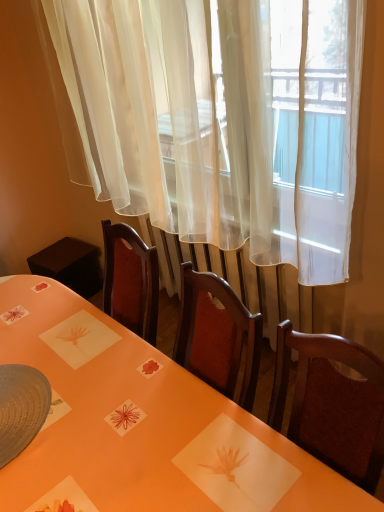
Question: Is orange glossy table at center far away from white sheer curtain at upper center?

Choices:
 (A) no
 (B) yes

Answer: (A)

Question: Can you confirm if orange glossy table at center is positioned to the left of white sheer curtain at upper center?

Choices:
 (A) no
 (B) yes

Answer: (B)

Question: Does orange glossy table at center have a greater width compared to white sheer curtain at upper center?

Choices:
 (A) no
 (B) yes

Answer: (B)

Question: Is orange glossy table at center positioned in front of white sheer curtain at upper center?

Choices:
 (A) yes
 (B) no

Answer: (A)

Question: Is orange glossy table at center surrounding white sheer curtain at upper center?

Choices:
 (A) yes
 (B) no

Answer: (B)

Question: From the image's perspective, would you say orange glossy table at center is positioned over white sheer curtain at upper center?

Choices:
 (A) yes
 (B) no

Answer: (B)

Question: From the image's perspective, is white sheer curtain at upper center under orange glossy table at center?

Choices:
 (A) no
 (B) yes

Answer: (A)

Question: Considering the relative sizes of white sheer curtain at upper center and orange glossy table at center in the image provided, is white sheer curtain at upper center bigger than orange glossy table at center?

Choices:
 (A) yes
 (B) no

Answer: (B)

Question: From a real-world perspective, is white sheer curtain at upper center under orange glossy table at center?

Choices:
 (A) yes
 (B) no

Answer: (B)

Question: Does white sheer curtain at upper center have a smaller size compared to orange glossy table at center?

Choices:
 (A) no
 (B) yes

Answer: (B)

Question: Could you tell me if white sheer curtain at upper center is turned towards orange glossy table at center?

Choices:
 (A) yes
 (B) no

Answer: (B)

Question: Is orange glossy table at center surrounded by white sheer curtain at upper center?

Choices:
 (A) no
 (B) yes

Answer: (A)

Question: Is white sheer curtain at upper center spatially inside orange glossy table at center, or outside of it?

Choices:
 (A) inside
 (B) outside

Answer: (B)